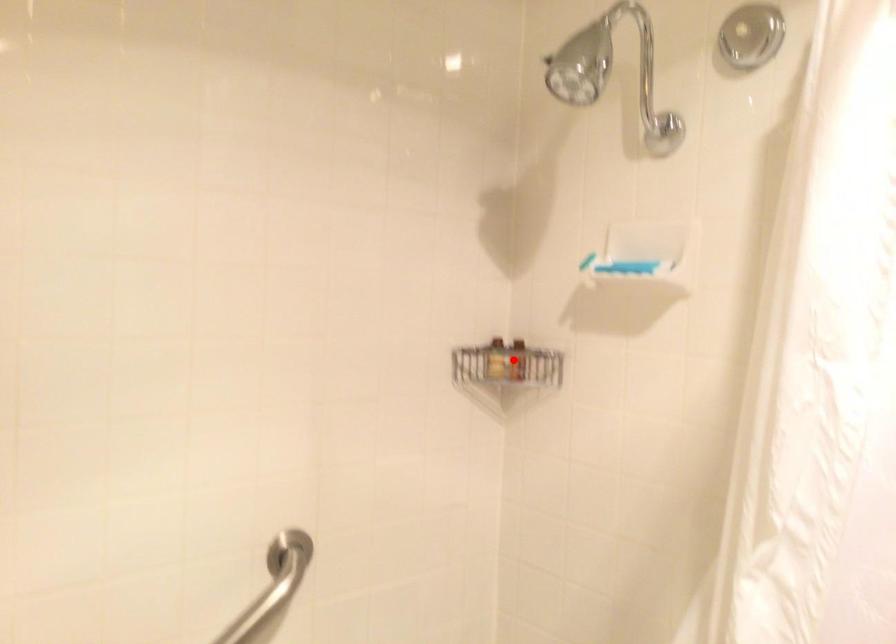
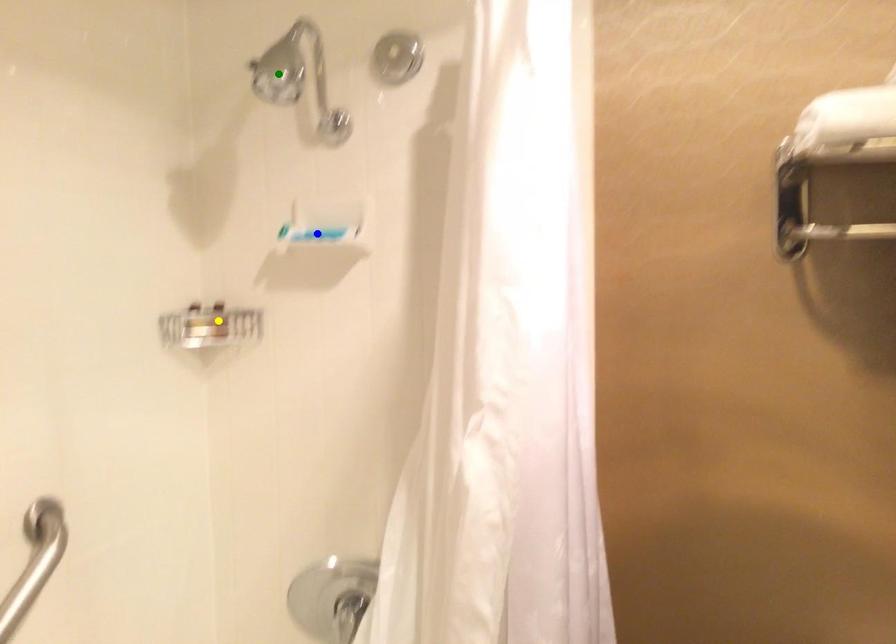
Question: I am providing you with two images of the same scene from different viewpoints. A red point is marked on the first image. You are given multiple points on the second image. In image 2, which mark is for the same physical point as the one in image 1?

Choices:
 (A) yellow point
 (B) blue point
 (C) green point

Answer: (A)